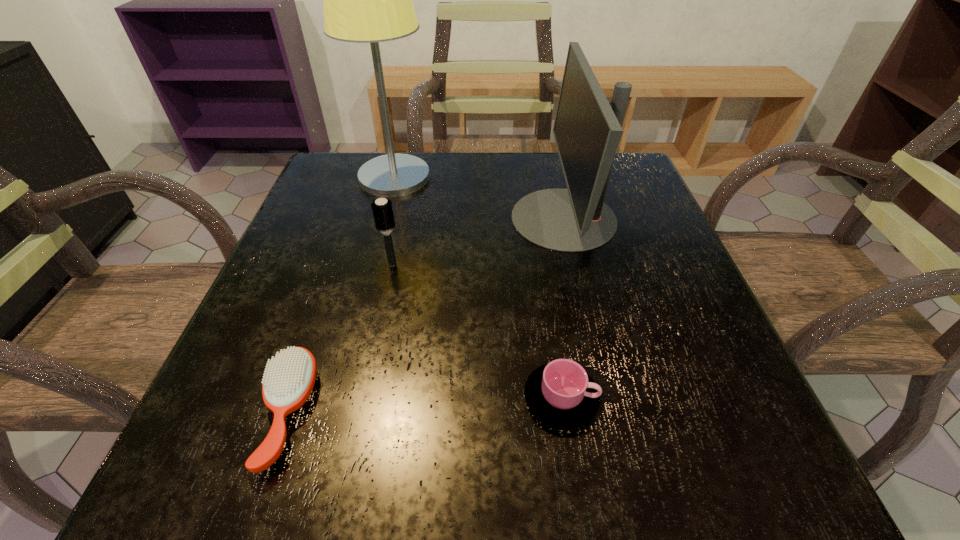
The width and height of the screenshot is (960, 540). I want to click on free space between the computer monitor and the right hairbrush, so click(x=478, y=241).

Identify the location of free space between the second tallest object and the nearer hairbrush. Image resolution: width=960 pixels, height=540 pixels. (425, 316).

At what (x,y) coordinates should I click in order to perform the action: click on free spot between the computer monitor and the tallest object. Please return your answer as a coordinate pair (x, y). Looking at the image, I should click on (479, 198).

The image size is (960, 540). What are the coordinates of `free spot between the left hairbrush and the right hairbrush` in the screenshot? It's located at (339, 339).

You are a GUI agent. You are given a task and a screenshot of the screen. Output one action in this format:
    pyautogui.click(x=<x>, y=<y>)
    Task: Click on the free space between the fourth shortest object and the cup
    The image size is (960, 540).
    Given the screenshot: What is the action you would take?
    pyautogui.click(x=563, y=308)

Where is `vacant space in between the second tallest object and the shorter hairbrush`? vacant space in between the second tallest object and the shorter hairbrush is located at coordinates (425, 316).

Locate an element on the screen. The image size is (960, 540). vacant space that's between the right hairbrush and the shorter hairbrush is located at coordinates (339, 339).

At what (x,y) coordinates should I click in order to perform the action: click on object that stands as the closest to the third tallest object. Please return your answer as a coordinate pair (x, y). Looking at the image, I should click on (366, 0).

Identify the location of the closest object to the right hairbrush. (366, 0).

This screenshot has height=540, width=960. What are the coordinates of `free spot that satisfies the following two spatial constraints: 1. on the screen of the computer monitor; 2. on the front side of the taller hairbrush` in the screenshot? It's located at (574, 264).